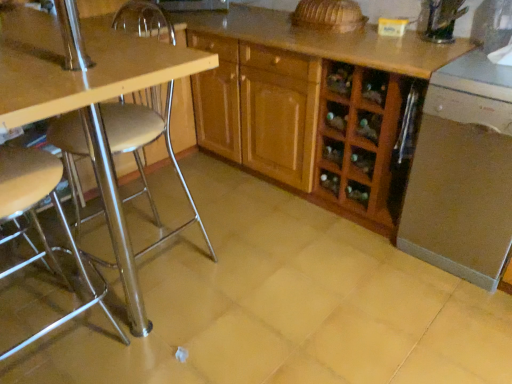
At what (x,y) coordinates should I click in order to perform the action: click on free space to the back side of metallic silver stool at left. Please return your answer as a coordinate pair (x, y). Looking at the image, I should click on (151, 301).